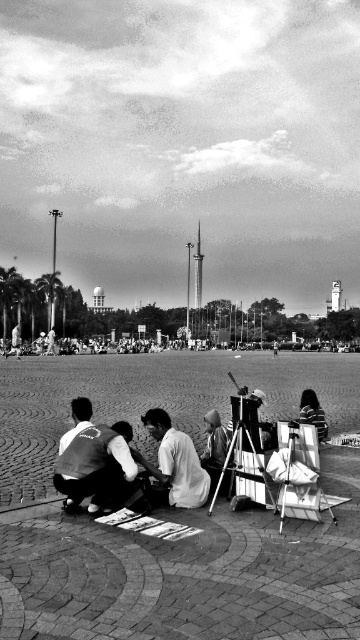
Question: Estimate the real-world distances between objects in this image. Which object is closer to the white cotton shirt at center?

Choices:
 (A) metallic tripod at center
 (B) light beige fabric shirt at center
 (C) striped shirt at center

Answer: (B)

Question: Does metallic tripod at center lie in front of striped shirt at center?

Choices:
 (A) no
 (B) yes

Answer: (B)

Question: Does metallic tripod at center come behind striped shirt at center?

Choices:
 (A) no
 (B) yes

Answer: (A)

Question: Can you confirm if metallic tripod at center is positioned below light beige fabric shirt at center?

Choices:
 (A) yes
 (B) no

Answer: (A)

Question: Which object is the farthest from the light beige fabric shirt at center?

Choices:
 (A) metallic tripod at center
 (B) striped shirt at center
 (C) white cotton shirt at center

Answer: (A)

Question: Which of these objects is positioned farthest from the light beige fabric shirt at center?

Choices:
 (A) striped shirt at center
 (B) white cotton shirt at center
 (C) metallic tripod at center

Answer: (C)